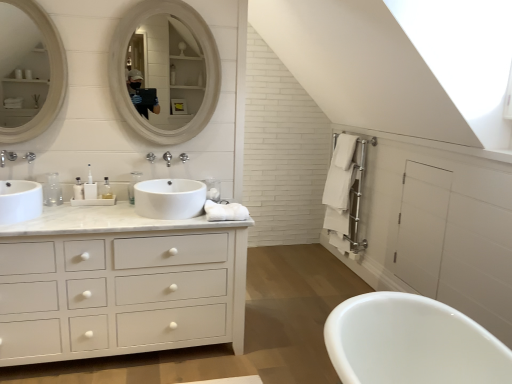
Image resolution: width=512 pixels, height=384 pixels. In order to click on free point to the right of white matte cabinet at left in this screenshot , I will do `click(266, 332)`.